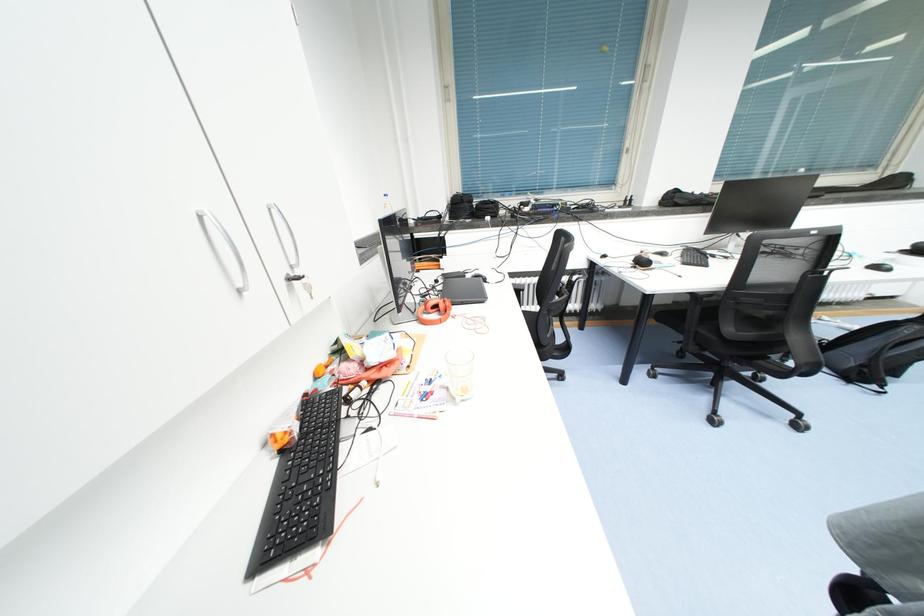
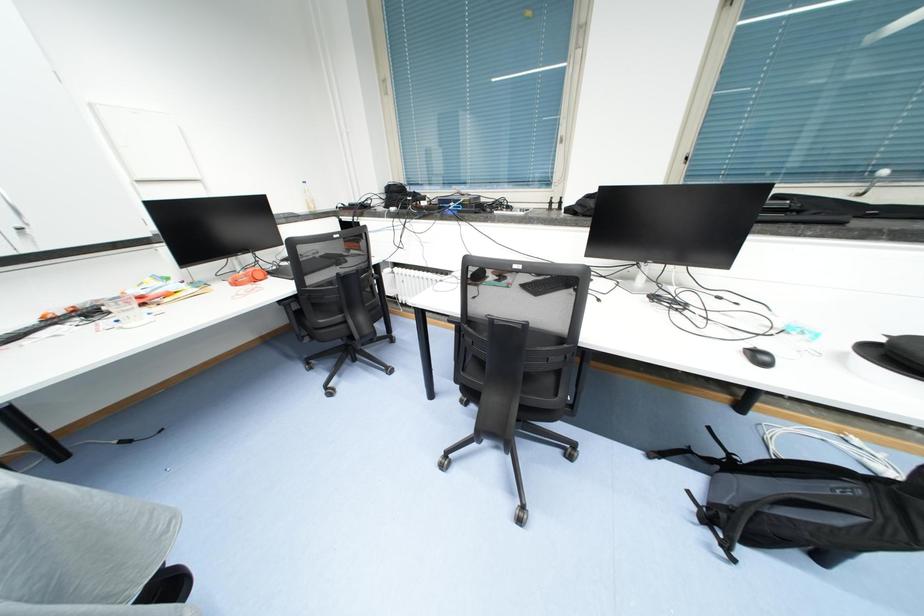
Question: In a continuous first-person perspective shot, in which direction is the camera moving?

Choices:
 (A) Left
 (B) Right
 (C) Forward
 (D) Backward

Answer: (B)